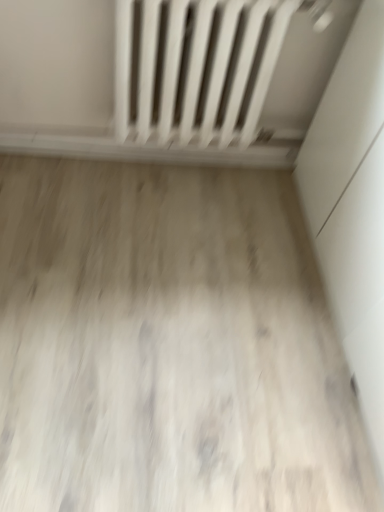
Question: Should I look upward or downward to see white matte radiator at upper center?

Choices:
 (A) up
 (B) down

Answer: (A)

Question: Is white matte radiator at upper center positioned before wooden floor at center?

Choices:
 (A) yes
 (B) no

Answer: (B)

Question: Considering the relative positions of white matte radiator at upper center and wooden floor at center in the image provided, is white matte radiator at upper center behind wooden floor at center?

Choices:
 (A) yes
 (B) no

Answer: (A)

Question: Considering the relative sizes of white matte radiator at upper center and wooden floor at center in the image provided, is white matte radiator at upper center shorter than wooden floor at center?

Choices:
 (A) no
 (B) yes

Answer: (A)

Question: Is white matte radiator at upper center smaller than wooden floor at center?

Choices:
 (A) yes
 (B) no

Answer: (B)

Question: Is white matte radiator at upper center to the right of wooden floor at center from the viewer's perspective?

Choices:
 (A) yes
 (B) no

Answer: (A)

Question: From a real-world perspective, is white matte radiator at upper center under wooden floor at center?

Choices:
 (A) yes
 (B) no

Answer: (B)

Question: Considering the relative positions of wooden floor at center and white matte radiator at upper center in the image provided, is wooden floor at center to the right of white matte radiator at upper center from the viewer's perspective?

Choices:
 (A) no
 (B) yes

Answer: (A)

Question: Considering the relative sizes of wooden floor at center and white matte radiator at upper center in the image provided, is wooden floor at center shorter than white matte radiator at upper center?

Choices:
 (A) yes
 (B) no

Answer: (A)

Question: Considering the relative sizes of wooden floor at center and white matte radiator at upper center in the image provided, is wooden floor at center thinner than white matte radiator at upper center?

Choices:
 (A) no
 (B) yes

Answer: (A)

Question: Can you see wooden floor at center touching white matte radiator at upper center?

Choices:
 (A) no
 (B) yes

Answer: (A)

Question: Is wooden floor at center not near white matte radiator at upper center?

Choices:
 (A) no
 (B) yes

Answer: (A)

Question: Does wooden floor at center appear on the left side of white matte radiator at upper center?

Choices:
 (A) yes
 (B) no

Answer: (A)

Question: Is white matte radiator at upper center bigger or smaller than wooden floor at center?

Choices:
 (A) big
 (B) small

Answer: (A)